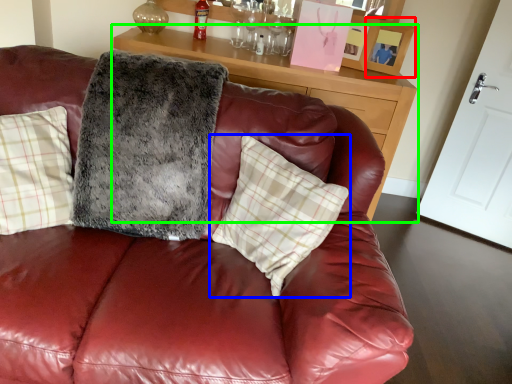
Question: Estimate the real-world distances between objects in this image. Which object is closer to picture frame (highlighted by a red box), pillow (highlighted by a blue box) or table (highlighted by a green box)?

Choices:
 (A) pillow
 (B) table

Answer: (B)